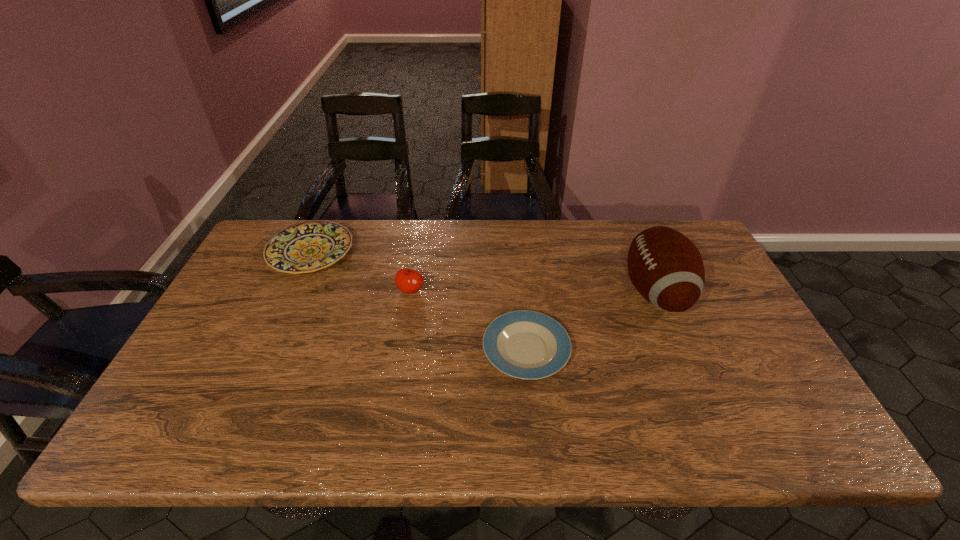
In the image, there is a desktop. Where is `vacant space at the far edge`? Image resolution: width=960 pixels, height=540 pixels. vacant space at the far edge is located at coordinates (355, 237).

This screenshot has height=540, width=960. What are the coordinates of `vacant space at the near edge of the desktop` in the screenshot? It's located at tap(393, 413).

This screenshot has height=540, width=960. Find the location of `free space at the left edge of the desktop`. free space at the left edge of the desktop is located at coordinates (279, 279).

You are a GUI agent. You are given a task and a screenshot of the screen. Output one action in this format:
    pyautogui.click(x=<x>, y=<y>)
    Task: Click on the vacant space at the right edge of the desktop
    
    Given the screenshot: What is the action you would take?
    pyautogui.click(x=748, y=323)

At what (x,y) coordinates should I click in order to perform the action: click on vacant area at the near left corner of the desktop. Please return your answer as a coordinate pair (x, y). This screenshot has width=960, height=540. Looking at the image, I should click on (164, 416).

The width and height of the screenshot is (960, 540). I want to click on vacant point located between the tallest object and the third shortest object, so click(x=533, y=291).

Locate an element on the screen. free area in between the rightmost object and the right plate is located at coordinates (590, 321).

You are a GUI agent. You are given a task and a screenshot of the screen. Output one action in this format:
    pyautogui.click(x=<x>, y=<y>)
    Task: Click on the empty location between the right plate and the rightmost object
    
    Given the screenshot: What is the action you would take?
    pyautogui.click(x=590, y=321)

I want to click on blank region between the second object from left to right and the second object from right to left, so click(468, 320).

Locate an element on the screen. free space between the leftmost object and the third shortest object is located at coordinates (361, 271).